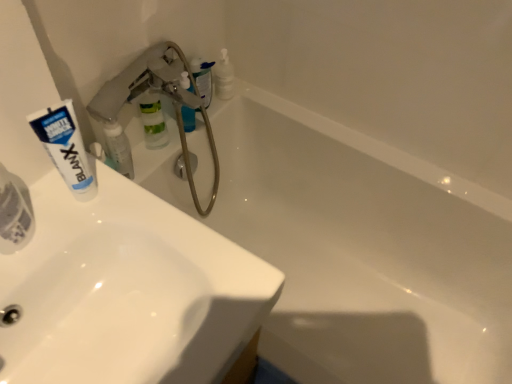
The image size is (512, 384). I want to click on translucent plastic bottle at upper center, placed as the 4th toiletry when sorted from front to back, so click(203, 78).

What are the coordinates of `white matte tube at upper left` in the screenshot? It's located at (65, 147).

Describe the element at coordinates (105, 311) in the screenshot. I see `white glossy sink at upper left, positioned as the second sink in front-to-back order` at that location.

Find the location of a particular element. The width and height of the screenshot is (512, 384). translucent plastic soap dispenser at upper center, which is the third toiletry in front-to-back order is located at coordinates (188, 118).

Describe the element at coordinates (126, 291) in the screenshot. The width and height of the screenshot is (512, 384). I see `white glossy sink at upper left, which is counted as the first sink, starting from the front` at that location.

At what (x,y) coordinates should I click in order to perform the action: click on translucent plastic bottle at upper center, placed as the 4th toiletry when sorted from front to back. Please return your answer as a coordinate pair (x, y). Looking at the image, I should click on coord(203,78).

Which object is closer to the camera, white glossy sink at upper left, the 2th sink positioned from the back, or white glossy sink at upper left, acting as the first sink starting from the back?

white glossy sink at upper left, the 2th sink positioned from the back, is more forward.

Which of these two, white glossy sink at upper left, the 2th sink positioned from the back, or white glossy sink at upper left, acting as the first sink starting from the back, stands shorter?

With less height is white glossy sink at upper left, the 2th sink positioned from the back.

Which object is positioned more to the left, white glossy sink at upper left, the 2th sink positioned from the back, or white glossy sink at upper left, positioned as the second sink in front-to-back order?

white glossy sink at upper left, positioned as the second sink in front-to-back order, is more to the left.

Which is behind, point (110, 302) or point (136, 281)?

The point (136, 281) is farther.

Considering the sizes of objects translucent plastic soap dispenser at upper center, which ranks as the 2th toiletry in back-to-front order, and translucent plastic toothpaste tube at left, the 1th toiletry viewed from the front, in the image provided, who is wider, translucent plastic soap dispenser at upper center, which ranks as the 2th toiletry in back-to-front order, or translucent plastic toothpaste tube at left, the 1th toiletry viewed from the front,?

translucent plastic soap dispenser at upper center, which ranks as the 2th toiletry in back-to-front order, is wider.

Does translucent plastic soap dispenser at upper center, which is the third toiletry in front-to-back order, contain translucent plastic toothpaste tube at left, placed as the fourth toiletry when sorted from back to front?

That's incorrect, translucent plastic toothpaste tube at left, placed as the fourth toiletry when sorted from back to front, is not inside translucent plastic soap dispenser at upper center, which is the third toiletry in front-to-back order.

Would you say translucent plastic soap dispenser at upper center, which ranks as the 2th toiletry in back-to-front order, is to the left or to the right of translucent plastic toothpaste tube at left, placed as the fourth toiletry when sorted from back to front, in the picture?

From the image, it's evident that translucent plastic soap dispenser at upper center, which ranks as the 2th toiletry in back-to-front order, is to the right of translucent plastic toothpaste tube at left, placed as the fourth toiletry when sorted from back to front.

Who is taller, translucent plastic soap dispenser at upper center, which is the third toiletry in front-to-back order, or translucent plastic toothpaste tube at left, the 1th toiletry viewed from the front?

Standing taller between the two is translucent plastic toothpaste tube at left, the 1th toiletry viewed from the front.

Who is taller, translucent plastic bottle at upper center, placed as the 4th toiletry when sorted from front to back, or white glossy bathtub at upper center?

Standing taller between the two is white glossy bathtub at upper center.

From a real-world perspective, relative to white glossy bathtub at upper center, is translucent plastic bottle at upper center, placed as the 4th toiletry when sorted from front to back, vertically above or below?

In terms of real-world spatial position, translucent plastic bottle at upper center, placed as the 4th toiletry when sorted from front to back, is above white glossy bathtub at upper center.

How far apart are translucent plastic bottle at upper center, placed as the 4th toiletry when sorted from front to back, and white glossy bathtub at upper center?

The distance of translucent plastic bottle at upper center, placed as the 4th toiletry when sorted from front to back, from white glossy bathtub at upper center is 21.54 inches.

Are translucent plastic bottle at upper center, placed as the 4th toiletry when sorted from front to back, and white glossy bathtub at upper center beside each other?

No, translucent plastic bottle at upper center, placed as the 4th toiletry when sorted from front to back, is not making contact with white glossy bathtub at upper center.

From a real-world perspective, between white glossy toothpaste tube at upper left, placed as the 2th toiletry when sorted from front to back, and white matte tube at upper left, who is vertically lower?

white glossy toothpaste tube at upper left, placed as the 2th toiletry when sorted from front to back, from a real-world perspective.

Considering the relative positions of white glossy toothpaste tube at upper left, placed as the 2th toiletry when sorted from front to back, and white matte tube at upper left in the image provided, is white glossy toothpaste tube at upper left, placed as the 2th toiletry when sorted from front to back, to the left of white matte tube at upper left from the viewer's perspective?

Correct, you'll find white glossy toothpaste tube at upper left, placed as the 2th toiletry when sorted from front to back, to the left of white matte tube at upper left.

Which is nearer, [119,150] or [62,169]?

Clearly, point [119,150] is more distant from the camera than point [62,169].

Is translucent plastic bottle at upper center, placed as the 4th toiletry when sorted from front to back, further to the viewer compared to translucent plastic soap dispenser at upper center, which is the third toiletry in front-to-back order?

Yes, it is behind translucent plastic soap dispenser at upper center, which is the third toiletry in front-to-back order.

Which object is positioned more to the left, translucent plastic bottle at upper center, which is counted as the 1th toiletry, starting from the back, or translucent plastic soap dispenser at upper center, which ranks as the 2th toiletry in back-to-front order?

translucent plastic soap dispenser at upper center, which ranks as the 2th toiletry in back-to-front order, is more to the left.

Is white matte tube at upper left surrounding white glossy sink at upper left, which is counted as the first sink, starting from the front?

Definitely not — white glossy sink at upper left, which is counted as the first sink, starting from the front, is not inside white matte tube at upper left.

Is point (46, 116) in front of point (223, 296)?

Yes.

From their relative heights in the image, would you say white matte tube at upper left is taller or shorter than white glossy sink at upper left, the 2th sink positioned from the back?

In the image, white matte tube at upper left appears to be taller than white glossy sink at upper left, the 2th sink positioned from the back.

Considering the sizes of white matte tube at upper left and white glossy sink at upper left, the 2th sink positioned from the back, in the image, is white matte tube at upper left wider or thinner than white glossy sink at upper left, the 2th sink positioned from the back,?

white matte tube at upper left is thinner than white glossy sink at upper left, the 2th sink positioned from the back.

From the image's perspective, which is below, white glossy sink at upper left, the 2th sink positioned from the back, or translucent plastic toothpaste tube at left, placed as the fourth toiletry when sorted from back to front?

white glossy sink at upper left, the 2th sink positioned from the back.

Which of these two, white glossy sink at upper left, which is counted as the first sink, starting from the front, or translucent plastic toothpaste tube at left, placed as the fourth toiletry when sorted from back to front, stands shorter?

white glossy sink at upper left, which is counted as the first sink, starting from the front.

There is a white glossy sink at upper left, the 2th sink positioned from the back. Identify the location of toiletry above it (from a real-world perspective). (14, 213).

Where is `sink on the right of the white glossy sink at upper left, positioned as the second sink in front-to-back order`? The width and height of the screenshot is (512, 384). sink on the right of the white glossy sink at upper left, positioned as the second sink in front-to-back order is located at coordinates (126, 291).

Locate an element on the screen. the 2nd toiletry in front of the translucent plastic soap dispenser at upper center, which ranks as the 2th toiletry in back-to-front order, counting from the anchor's position is located at coordinates (14, 213).

Looking at the image, which one is located further to white matte tube at upper left, white glossy bathtub at upper center or translucent plastic soap dispenser at upper center, which ranks as the 2th toiletry in back-to-front order?

white glossy bathtub at upper center.

From the image, which object appears to be nearer to white glossy sink at upper left, the 2th sink positioned from the back, white glossy bathtub at upper center or white matte tube at upper left?

white matte tube at upper left lies closer to white glossy sink at upper left, the 2th sink positioned from the back, than the other object.

Which object lies further to the anchor point white glossy bathtub at upper center, translucent plastic toothpaste tube at left, the 1th toiletry viewed from the front, or white glossy toothpaste tube at upper left, placed as the 2th toiletry when sorted from front to back?

Among the two, translucent plastic toothpaste tube at left, the 1th toiletry viewed from the front, is located further to white glossy bathtub at upper center.

Based on their spatial positions, is white glossy sink at upper left, the 2th sink positioned from the back, or translucent plastic bottle at upper center, placed as the 4th toiletry when sorted from front to back, further from translucent plastic toothpaste tube at left, the 1th toiletry viewed from the front?

translucent plastic bottle at upper center, placed as the 4th toiletry when sorted from front to back, is positioned further to the anchor translucent plastic toothpaste tube at left, the 1th toiletry viewed from the front.

When comparing their distances from white glossy sink at upper left, acting as the first sink starting from the back, does white glossy toothpaste tube at upper left, acting as the third toiletry starting from the back, or white glossy bathtub at upper center seem closer?

white glossy toothpaste tube at upper left, acting as the third toiletry starting from the back, is positioned closer to the anchor white glossy sink at upper left, acting as the first sink starting from the back.

Which object lies nearer to the anchor point white glossy bathtub at upper center, white glossy sink at upper left, positioned as the second sink in front-to-back order, or white glossy sink at upper left, which is counted as the first sink, starting from the front?

white glossy sink at upper left, which is counted as the first sink, starting from the front, lies closer to white glossy bathtub at upper center than the other object.

Which object lies further to the anchor point white glossy bathtub at upper center, white glossy sink at upper left, the 2th sink positioned from the back, or translucent plastic toothpaste tube at left, placed as the fourth toiletry when sorted from back to front?

Based on the image, translucent plastic toothpaste tube at left, placed as the fourth toiletry when sorted from back to front, appears to be further to white glossy bathtub at upper center.

Based on their spatial positions, is translucent plastic toothpaste tube at left, placed as the fourth toiletry when sorted from back to front, or white glossy sink at upper left, which is counted as the first sink, starting from the front, closer to white glossy bathtub at upper center?

white glossy sink at upper left, which is counted as the first sink, starting from the front, lies closer to white glossy bathtub at upper center than the other object.

Where is `toiletry between white matte tube at upper left and translucent plastic soap dispenser at upper center, which is the third toiletry in front-to-back order, along the z-axis`? toiletry between white matte tube at upper left and translucent plastic soap dispenser at upper center, which is the third toiletry in front-to-back order, along the z-axis is located at coordinates (119, 148).

Identify the location of toiletry between white glossy sink at upper left, acting as the first sink starting from the back, and translucent plastic soap dispenser at upper center, which ranks as the 2th toiletry in back-to-front order, in the front-back direction. Image resolution: width=512 pixels, height=384 pixels. (119, 148).

Where is `toothpaste between white glossy sink at upper left, the 2th sink positioned from the back, and white glossy toothpaste tube at upper left, acting as the third toiletry starting from the back, from front to back`? The image size is (512, 384). toothpaste between white glossy sink at upper left, the 2th sink positioned from the back, and white glossy toothpaste tube at upper left, acting as the third toiletry starting from the back, from front to back is located at coordinates (65, 147).

I want to click on sink positioned between white glossy sink at upper left, the 2th sink positioned from the back, and white glossy toothpaste tube at upper left, placed as the 2th toiletry when sorted from front to back, from near to far, so click(105, 311).